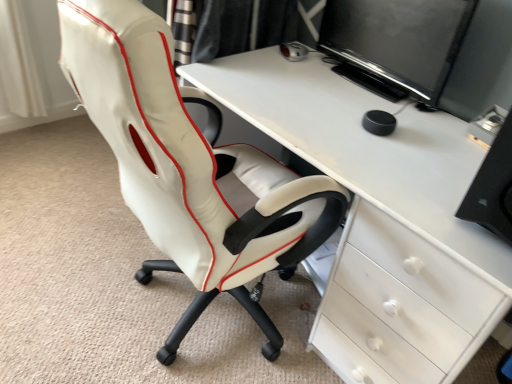
Question: In terms of width, does white glossy desk at center look wider or thinner when compared to black glossy monitor at upper right?

Choices:
 (A) thin
 (B) wide

Answer: (B)

Question: From the image's perspective, is white glossy desk at center positioned above or below black glossy monitor at upper right?

Choices:
 (A) below
 (B) above

Answer: (A)

Question: Estimate the real-world distances between objects in this image. Which object is closer to the white leather chair at center?

Choices:
 (A) black plastic computer tower at right
 (B) black glossy monitor at upper right
 (C) white glossy desk at center

Answer: (C)

Question: Which is nearer to the white glossy desk at center?

Choices:
 (A) white leather chair at center
 (B) black glossy monitor at upper right
 (C) black plastic computer tower at right

Answer: (A)